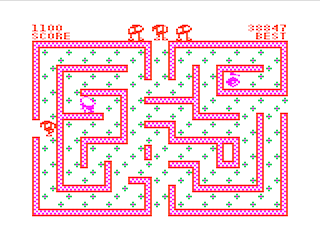
Where is `wall outline`? wall outline is located at coordinates (32, 164).